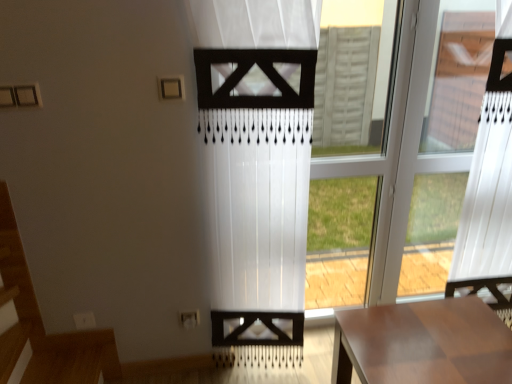
Where is `blank area beneath white sheer curtain at center (from a real-world perspective)`? This screenshot has width=512, height=384. blank area beneath white sheer curtain at center (from a real-world perspective) is located at coordinates (251, 374).